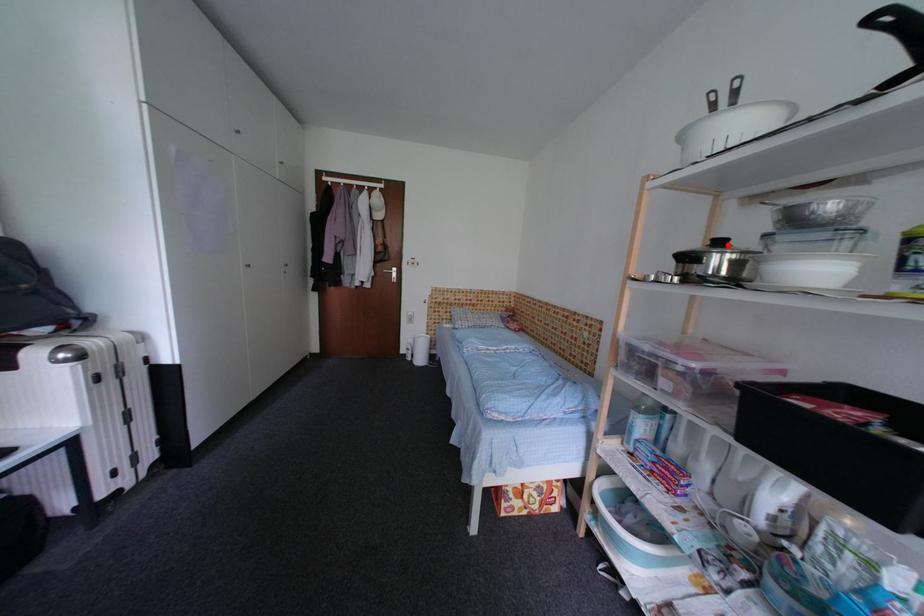
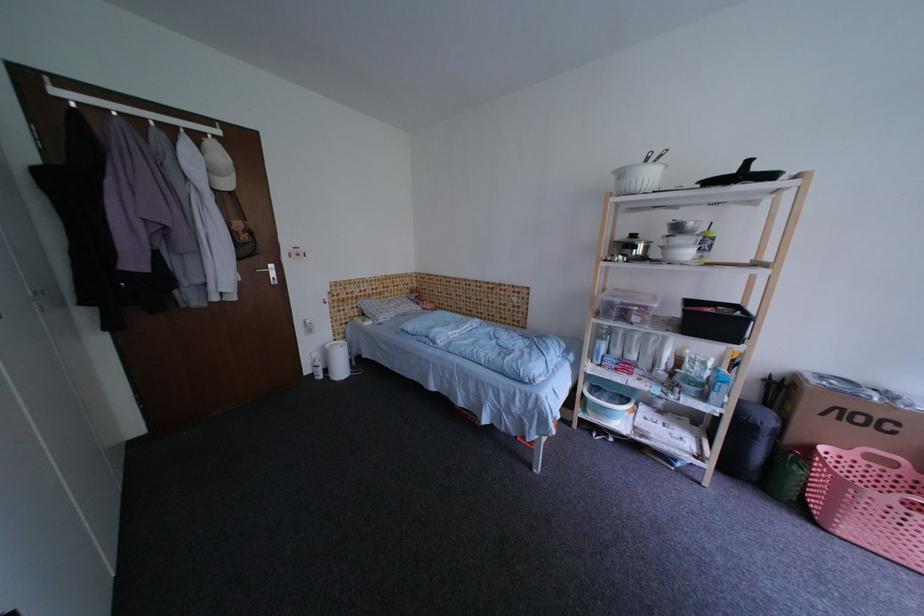
Where in the second image is the point corresponding to the highlighted location from the first image?

(641, 238)